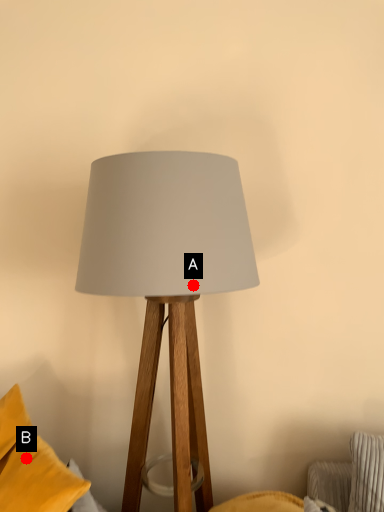
Question: Two points are circled on the image, labeled by A and B beside each circle. Which point is closer to the camera?

Choices:
 (A) A is closer
 (B) B is closer

Answer: (A)